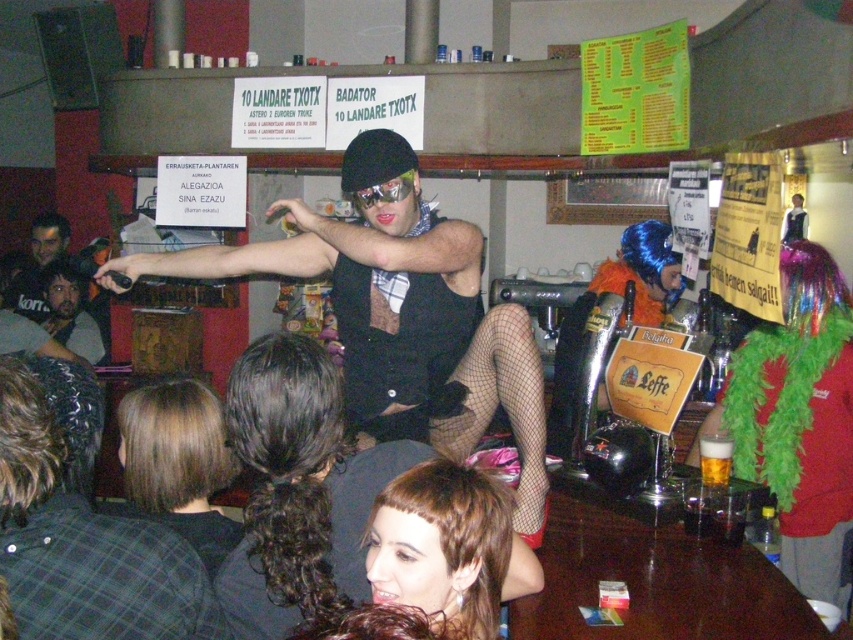
Question: Which of the following is the farthest from the observer?

Choices:
 (A) black mesh stockings at center
 (B) matte black shirt at center
 (C) golden glass beer at bar right
 (D) green feather boa at upper right

Answer: (B)

Question: Is shiny brown hair at lower center wider than golden glass beer at bar right?

Choices:
 (A) yes
 (B) no

Answer: (A)

Question: Which object is closer to the camera taking this photo?

Choices:
 (A) black mesh stockings at center
 (B) matte black shirt at center

Answer: (A)

Question: In this image, where is black mesh stockings at center located relative to green feather boa at upper right?

Choices:
 (A) right
 (B) left

Answer: (B)

Question: Which point is closer to the camera?

Choices:
 (A) shiny brown hair at lower center
 (B) matte black shirt at center
 (C) golden glass beer at bar right
 (D) black mesh stockings at center

Answer: (A)

Question: Does green feather boa at upper right come behind blonde hair at lower left?

Choices:
 (A) yes
 (B) no

Answer: (A)